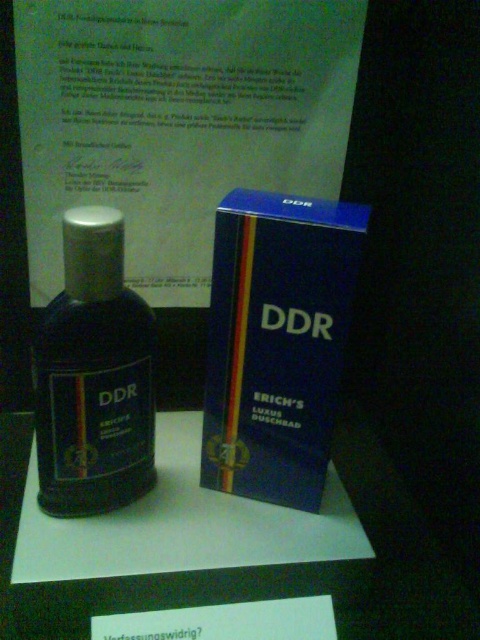
This screenshot has width=480, height=640. Describe the element at coordinates (276, 342) in the screenshot. I see `blue matte box at center` at that location.

Which is in front, point (274, 362) or point (121, 307)?

Point (121, 307)

You are a GUI agent. You are given a task and a screenshot of the screen. Output one action in this format:
    pyautogui.click(x=<x>, y=<y>)
    Task: Click on the blue matte box at center
    
    Given the screenshot: What is the action you would take?
    (276, 342)

Who is positioned more to the left, matte black bottle at center or white paper at center?

Positioned to the left is matte black bottle at center.

Does matte black bottle at center have a greater width compared to white paper at center?

In fact, matte black bottle at center might be narrower than white paper at center.

Which is behind, point (130, 378) or point (372, 582)?

The point (372, 582) is more distant.

Locate an element on the screen. matte black bottle at center is located at coordinates (94, 376).

Is blue matte box at center wider than white paper at center?

Incorrect, blue matte box at center's width does not surpass white paper at center's.

Does point (336, 252) come behind point (146, 593)?

No, it is in front of (146, 593).

I want to click on blue matte box at center, so click(x=276, y=342).